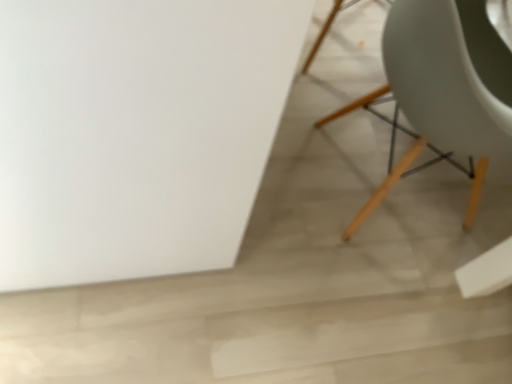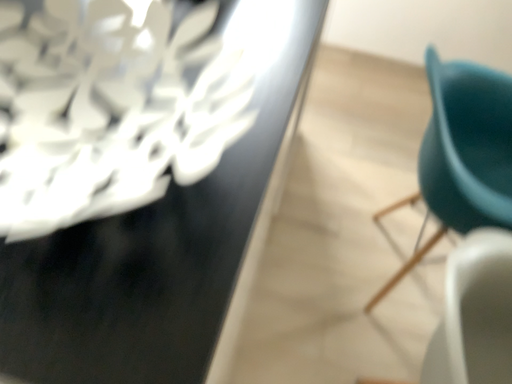
Question: How did the camera likely rotate when shooting the video?

Choices:
 (A) rotated upward
 (B) rotated downward

Answer: (A)